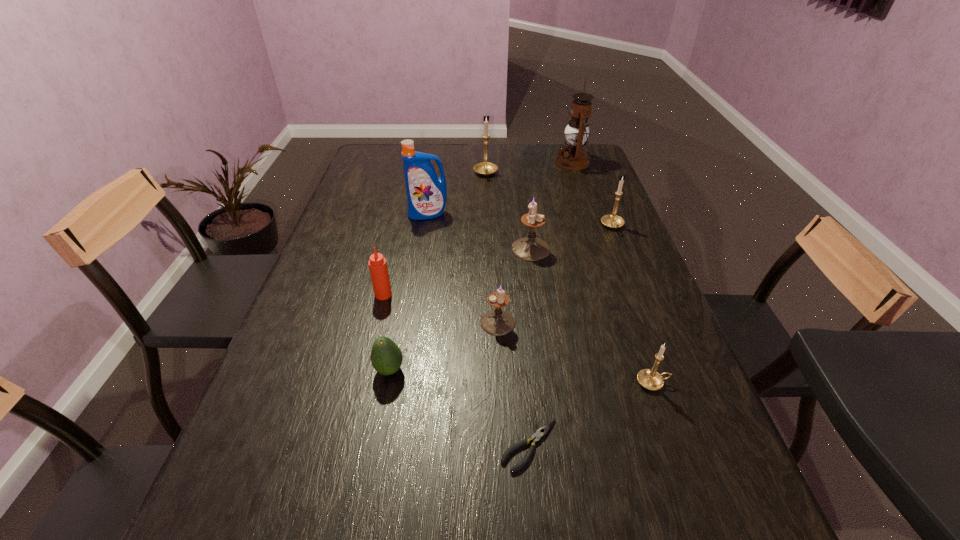
Point out which gold candle holder is positioned as the second nearest to the smallest gold candle holder. Please provide its 2D coordinates. Your answer should be formatted as a tuple, i.e. [(x, y)], where the tuple contains the x and y coordinates of a point satisfying the conditions above.

[(485, 168)]

Select which gold candle holder is the closest to the green avocado. Please provide its 2D coordinates. Your answer should be formatted as a tuple, i.e. [(x, y)], where the tuple contains the x and y coordinates of a point satisfying the conditions above.

[(650, 379)]

Find the location of a particular element. free region that satisfies the following two spatial constraints: 1. on the front side of the shortest object; 2. on the right side of the second shortest object is located at coordinates (375, 446).

At what (x,y) coordinates should I click in order to perform the action: click on free space that satisfies the following two spatial constraints: 1. on the label of the detergent; 2. on the left side of the shortest object. Please return your answer as a coordinate pair (x, y). This screenshot has height=540, width=960. Looking at the image, I should click on (391, 446).